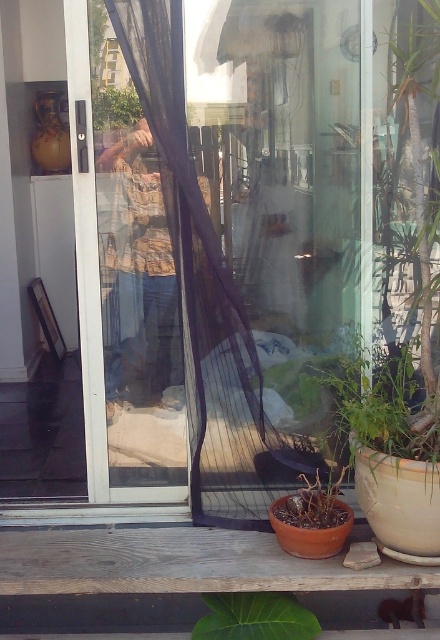
Can you confirm if green leafy plant at lower center is positioned above brown matte pot at lower center?

Actually, green leafy plant at lower center is below brown matte pot at lower center.

Is point (227, 593) farther from camera compared to point (296, 506)?

That is False.

What do you see at coordinates (255, 618) in the screenshot? I see `green leafy plant at lower center` at bounding box center [255, 618].

At what (x,y) coordinates should I click in order to perform the action: click on green leafy plant at lower center. Please return your answer as a coordinate pair (x, y). The image size is (440, 640). Looking at the image, I should click on (255, 618).

Does point (297, 465) come farther from viewer compared to point (327, 376)?

Yes, point (297, 465) is farther from viewer.

Can you confirm if transparent purple curtain at center is wider than green leafy plant at lower right?

Yes.

The height and width of the screenshot is (640, 440). Describe the element at coordinates (204, 284) in the screenshot. I see `transparent purple curtain at center` at that location.

Where is `transparent purple curtain at center`? transparent purple curtain at center is located at coordinates (204, 284).

Who is positioned more to the right, green leafy plant at lower center or green leafy plant at center?

green leafy plant at lower center is more to the right.

Can you confirm if green leafy plant at lower center is positioned to the left of green leafy plant at center?

Incorrect, green leafy plant at lower center is not on the left side of green leafy plant at center.

The width and height of the screenshot is (440, 640). What are the coordinates of `green leafy plant at lower center` in the screenshot? It's located at (255, 618).

The image size is (440, 640). I want to click on green leafy plant at lower center, so click(x=255, y=618).